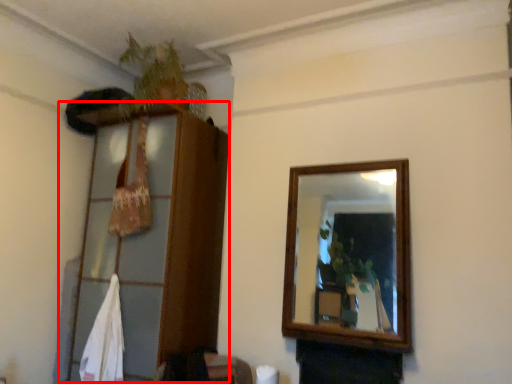
Question: From the image's perspective, where is dresser (annotated by the red box) located relative to plant?

Choices:
 (A) below
 (B) above

Answer: (A)